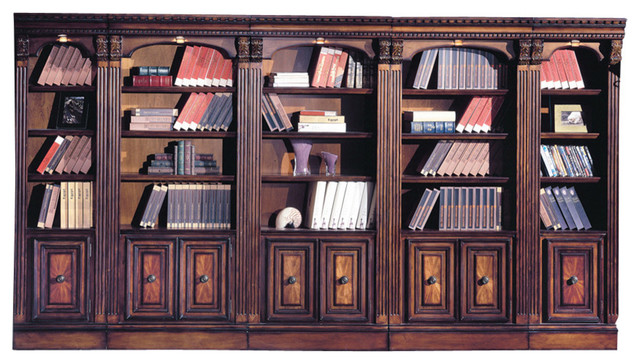
Where is `door`? door is located at coordinates click(x=63, y=281), click(x=150, y=278), click(x=204, y=280), click(x=288, y=281), click(x=338, y=280), click(x=438, y=269), click(x=486, y=270), click(x=563, y=278).